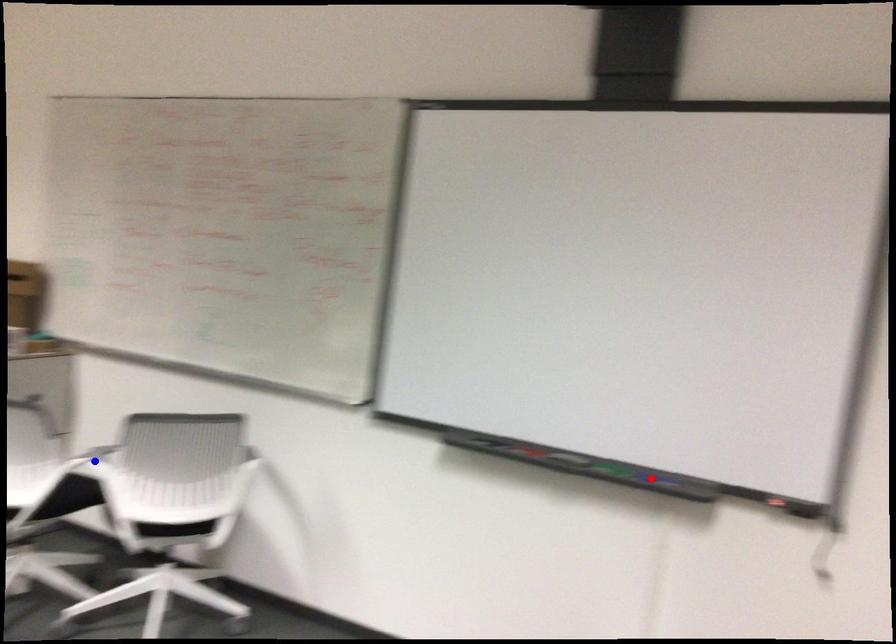
Question: In the image, two points are highlighted. Which point is nearer to the camera? Reply with the corresponding letter.

Choices:
 (A) blue point
 (B) red point

Answer: (B)